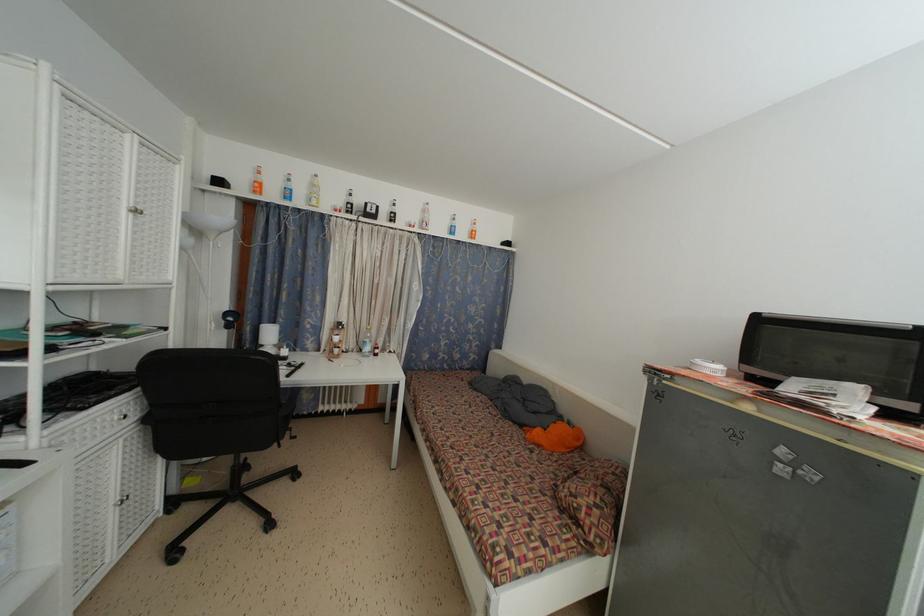
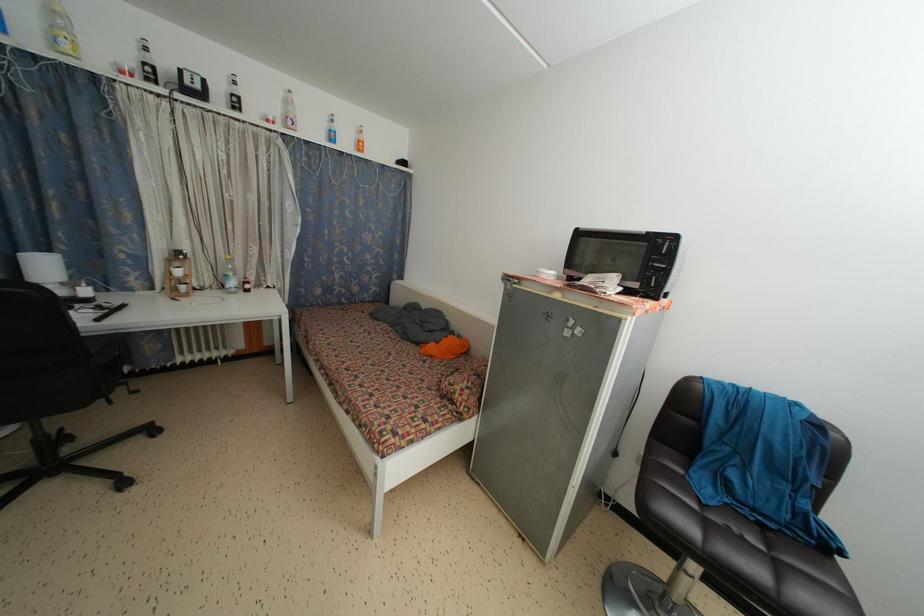
Find the pixel in the second image that matches the point at 304,368 in the first image.

(122, 310)